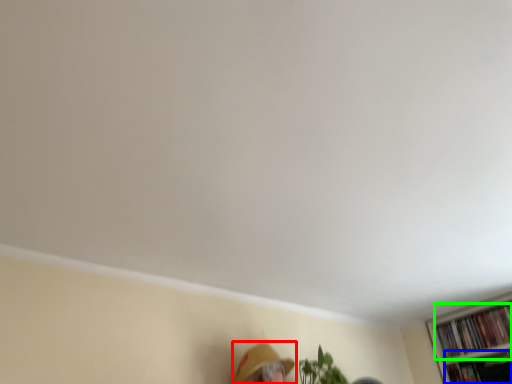
Question: Which object is the closest to the person (highlighted by a red box)? Choose among these: book (highlighted by a blue box) or book (highlighted by a green box).

Choices:
 (A) book
 (B) book

Answer: (B)